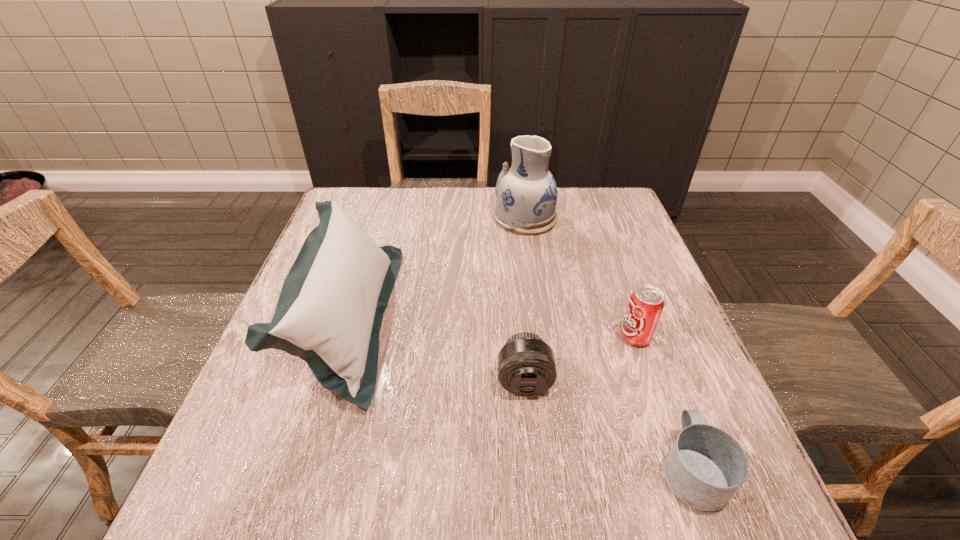
Find the location of a particular element. The height and width of the screenshot is (540, 960). vacant space positioned 0.230m on the left of the soda is located at coordinates 511,337.

This screenshot has width=960, height=540. Find the location of `free point located on the front-facing side of the telephoto lens`. free point located on the front-facing side of the telephoto lens is located at coordinates (533, 470).

The image size is (960, 540). I want to click on free space located 0.170m on the side of the mug with the handle, so click(650, 353).

Find the location of a particular element. Image resolution: width=960 pixels, height=540 pixels. free space located on the side of the mug with the handle is located at coordinates (668, 405).

I want to click on free region located on the side of the mug with the handle, so click(x=630, y=299).

The image size is (960, 540). Find the location of `object situated at the far edge`. object situated at the far edge is located at coordinates (526, 193).

At what (x,y) coordinates should I click in order to perform the action: click on object positioned at the near edge. Please return your answer as a coordinate pair (x, y). This screenshot has height=540, width=960. Looking at the image, I should click on (705, 467).

You are a GUI agent. You are given a task and a screenshot of the screen. Output one action in this format:
    pyautogui.click(x=<x>, y=<y>)
    Task: Click on the object at the left edge
    Image resolution: width=960 pixels, height=540 pixels.
    Given the screenshot: What is the action you would take?
    pyautogui.click(x=330, y=310)

The image size is (960, 540). I want to click on soda that is at the right edge, so click(x=646, y=304).

The image size is (960, 540). Find the location of `mug that is at the right edge`. mug that is at the right edge is located at coordinates (705, 467).